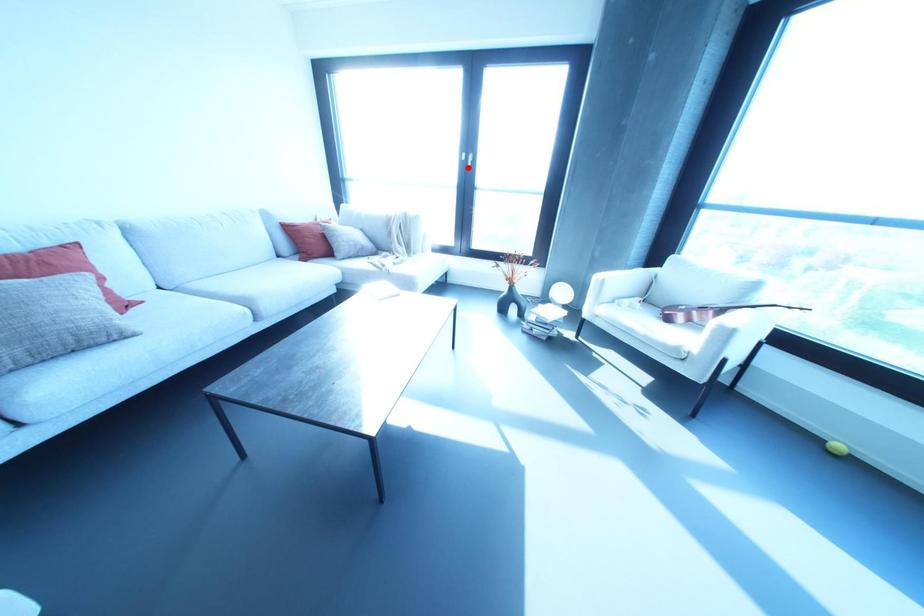
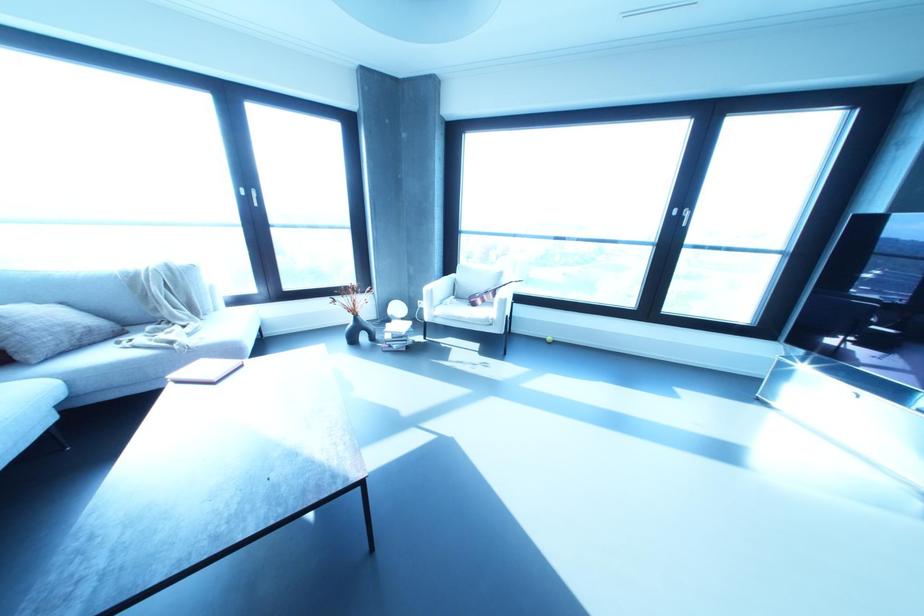
In the second image, find the point that corresponds to the highlighted location in the first image.

(254, 205)